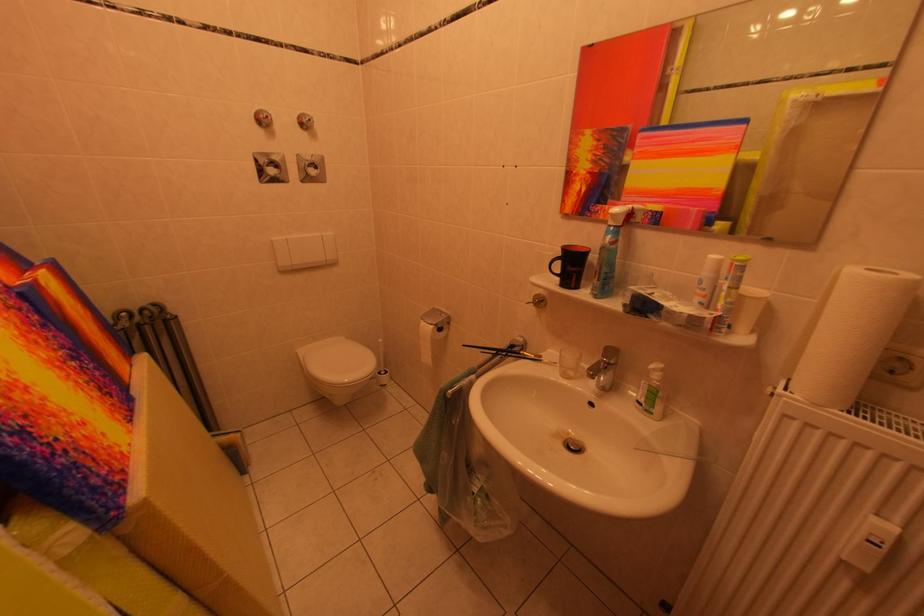
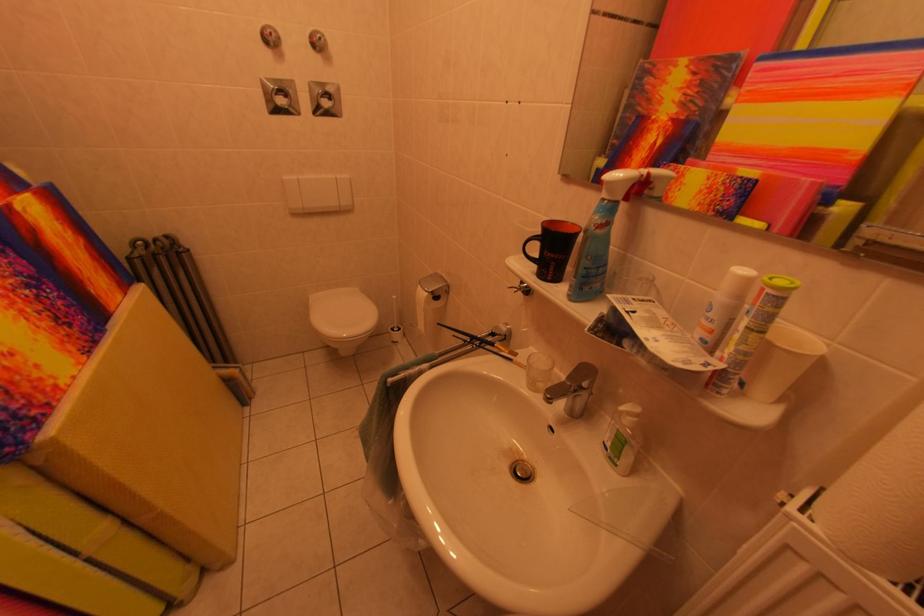
In the second image, find the point that corresponds to (311,355) in the first image.

(322, 301)